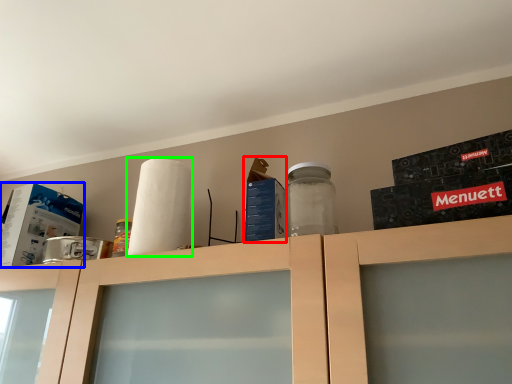
Question: Which is farther away from box (highlighted by a red box)? box (highlighted by a blue box) or paper towel (highlighted by a green box)?

Choices:
 (A) box
 (B) paper towel

Answer: (A)